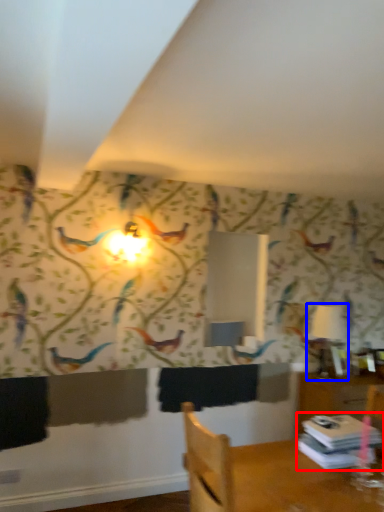
Question: Which object is closer to the camera taking this photo, book (highlighted by a red box) or table lamp (highlighted by a blue box)?

Choices:
 (A) book
 (B) table lamp

Answer: (A)